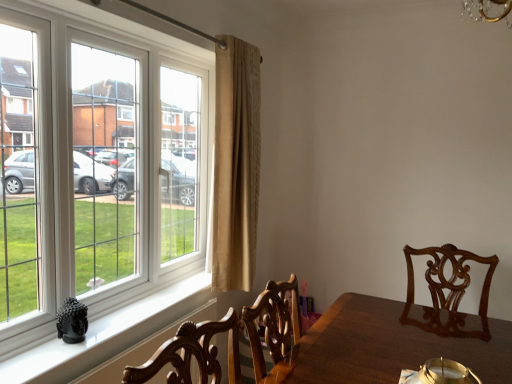
Question: Considering the relative sizes of black glossy buddha statue at lower left and beige textured curtain at center in the image provided, is black glossy buddha statue at lower left taller than beige textured curtain at center?

Choices:
 (A) no
 (B) yes

Answer: (A)

Question: Does black glossy buddha statue at lower left turn towards beige textured curtain at center?

Choices:
 (A) no
 (B) yes

Answer: (A)

Question: Would you say black glossy buddha statue at lower left is outside beige textured curtain at center?

Choices:
 (A) no
 (B) yes

Answer: (B)

Question: Is the depth of black glossy buddha statue at lower left greater than that of beige textured curtain at center?

Choices:
 (A) no
 (B) yes

Answer: (A)

Question: From the image's perspective, is black glossy buddha statue at lower left under beige textured curtain at center?

Choices:
 (A) no
 (B) yes

Answer: (B)

Question: From their relative heights in the image, would you say beige textured curtain at center is taller or shorter than white plastic window at left?

Choices:
 (A) short
 (B) tall

Answer: (B)

Question: Visually, is beige textured curtain at center positioned to the left or to the right of white plastic window at left?

Choices:
 (A) right
 (B) left

Answer: (A)

Question: Is beige textured curtain at center inside or outside of white plastic window at left?

Choices:
 (A) inside
 (B) outside

Answer: (B)

Question: From the image's perspective, relative to white plastic window at left, is beige textured curtain at center above or below?

Choices:
 (A) below
 (B) above

Answer: (B)

Question: From a real-world perspective, is black glossy buddha statue at lower left positioned above or below white plastic window at left?

Choices:
 (A) below
 (B) above

Answer: (A)

Question: Considering their positions, is black glossy buddha statue at lower left located in front of or behind white plastic window at left?

Choices:
 (A) front
 (B) behind

Answer: (B)

Question: Is black glossy buddha statue at lower left wider or thinner than white plastic window at left?

Choices:
 (A) wide
 (B) thin

Answer: (B)

Question: In terms of size, does black glossy buddha statue at lower left appear bigger or smaller than white plastic window at left?

Choices:
 (A) small
 (B) big

Answer: (A)

Question: Considering the positions of black glossy buddha statue at lower left and beige textured curtain at center in the image, is black glossy buddha statue at lower left taller or shorter than beige textured curtain at center?

Choices:
 (A) tall
 (B) short

Answer: (B)

Question: Looking at their shapes, would you say black glossy buddha statue at lower left is wider or thinner than beige textured curtain at center?

Choices:
 (A) wide
 (B) thin

Answer: (B)